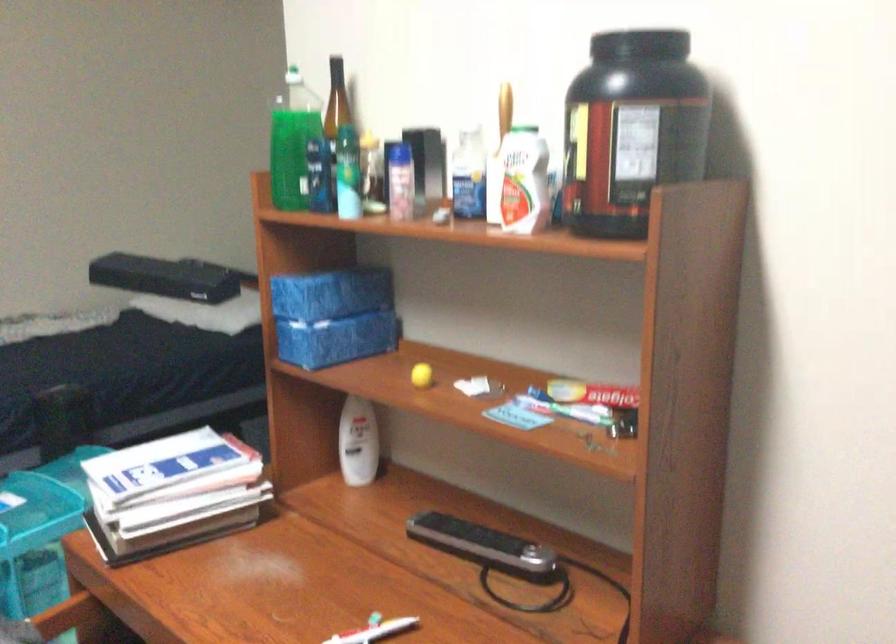
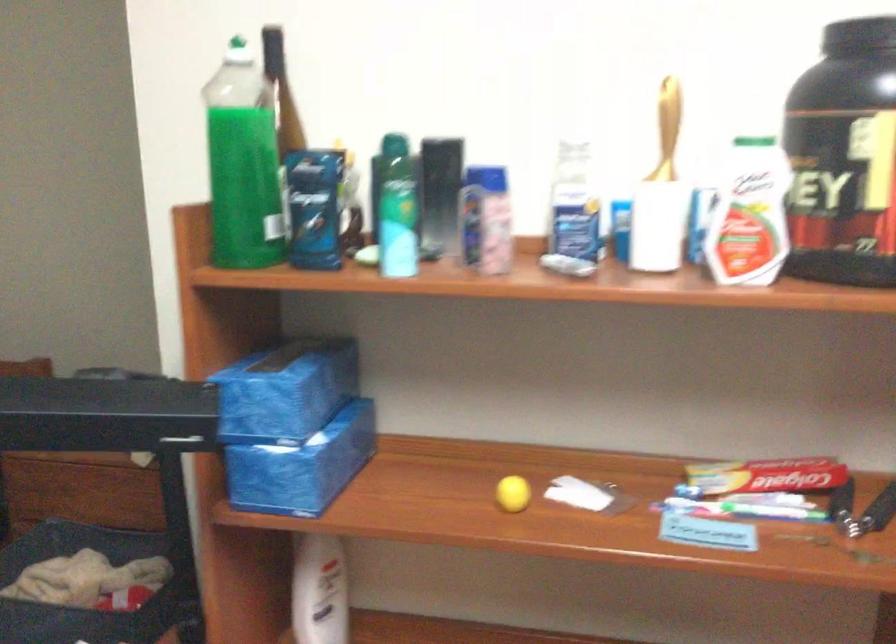
In the second image, find the point that corresponds to point 604,400 in the first image.

(764, 483)